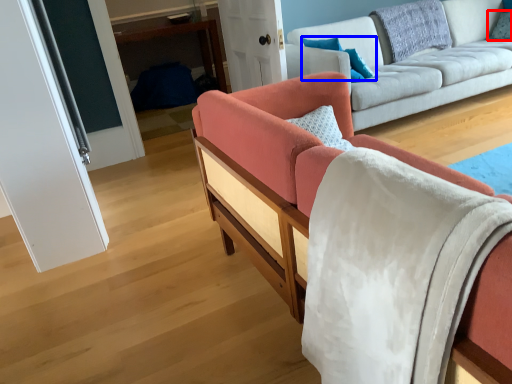
Question: Which object appears closest to the camera in this image, pillow (highlighted by a red box) or pillow (highlighted by a blue box)?

Choices:
 (A) pillow
 (B) pillow

Answer: (B)